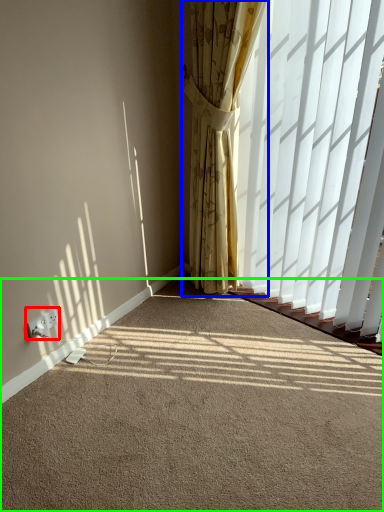
Question: Based on their relative distances, which object is farther from electric outlet (highlighted by a red box)? Choose from curtain (highlighted by a blue box) and plain (highlighted by a green box).

Choices:
 (A) curtain
 (B) plain

Answer: (A)